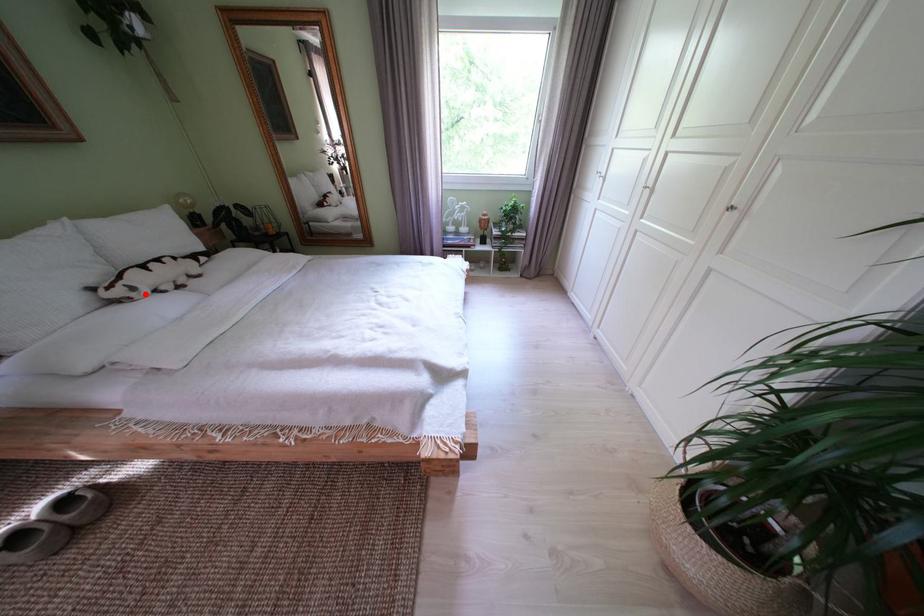
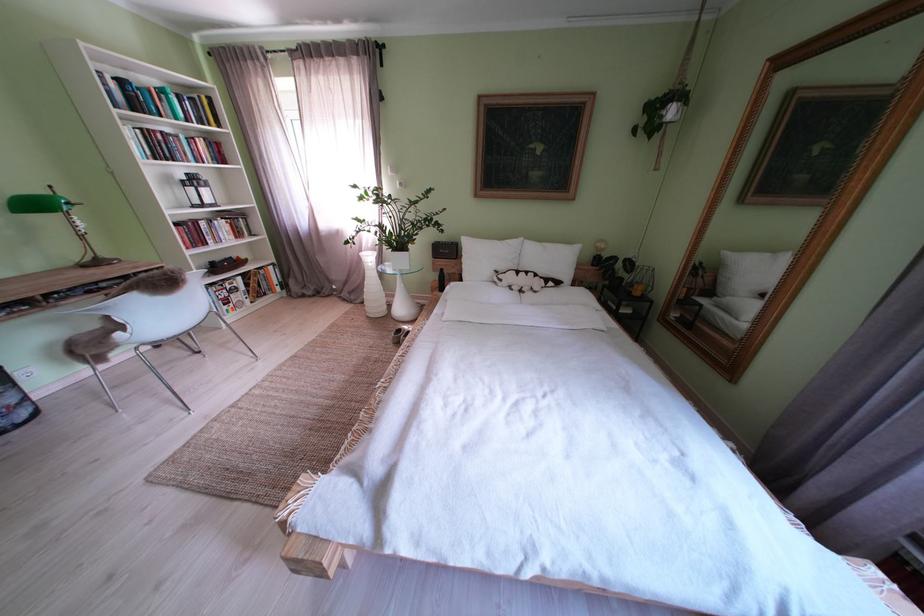
Where in the second image is the point corresponding to the highlighted location from the first image?

(512, 285)